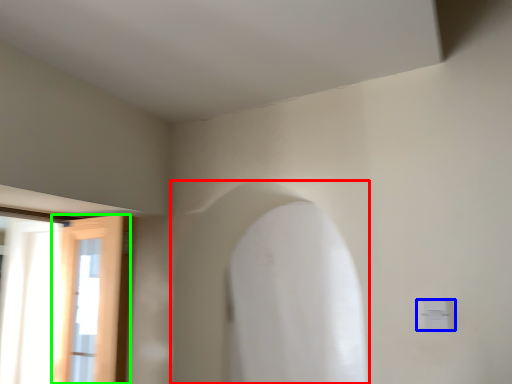
Question: Which object is positioned closest to archway (highlighted by a red box)? Select from electric outlet (highlighted by a blue box) and door (highlighted by a green box).

Choices:
 (A) electric outlet
 (B) door

Answer: (B)